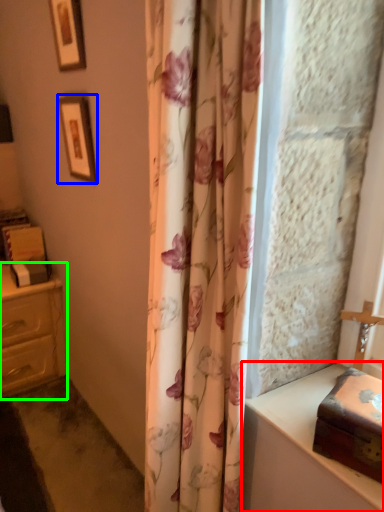
Question: Considering the real-world distances, which object is farthest from vanity (highlighted by a red box)? picture frame (highlighted by a blue box) or chest of drawers (highlighted by a green box)?

Choices:
 (A) picture frame
 (B) chest of drawers

Answer: (B)